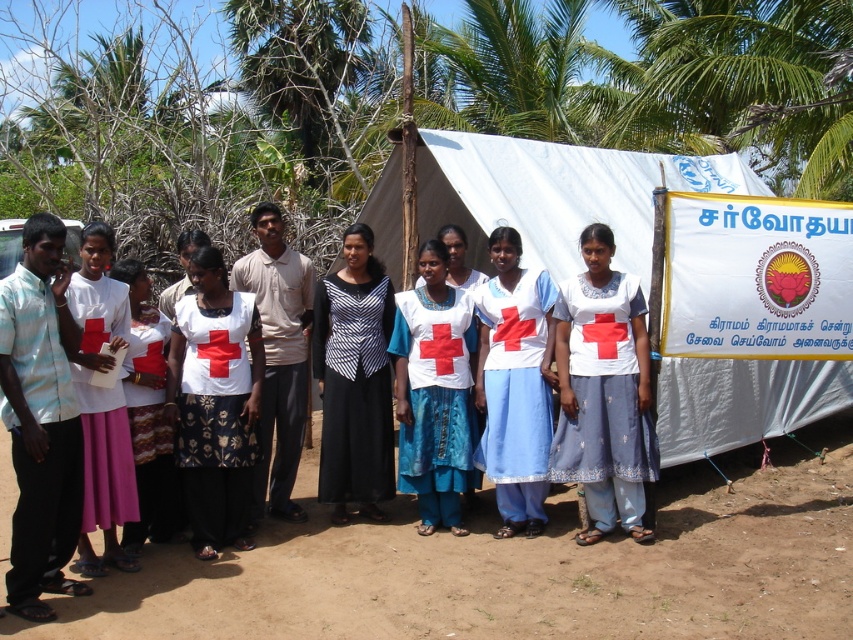
You are a photographer planning to take a group photo of the scene. The white fabric tent at center and the black striped dress at center are both in the frame. Since you want to ensure both are clearly visible, which object should you focus on first considering their sizes?

The white fabric tent at center is larger in width than the black striped dress at center, so you should focus on the white fabric tent at center first as it occupies more space in the frame.

You are organizing a clothing donation drive and need to determine which item takes up more space in a storage box. Based on the image, which item is wider between the white matte shirt at center and the white fabric skirt at lower left?

The white matte shirt at center is wider than the white fabric skirt at lower left according to the description provided.